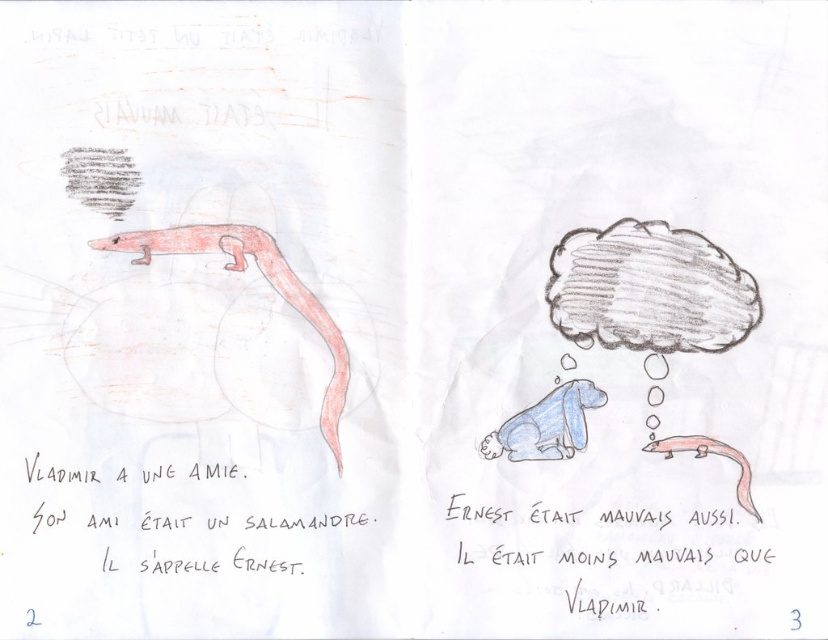
Question: Is pink matte salamander at center in front of blue paper dog at center?

Choices:
 (A) yes
 (B) no

Answer: (A)

Question: Does pink matte salamander at center have a greater width compared to blue paper dog at center?

Choices:
 (A) no
 (B) yes

Answer: (B)

Question: Which object is closer to the camera taking this photo?

Choices:
 (A) pink matte salamander at center
 (B) blue paper dog at center
 (C) gray textured cloud at upper center
 (D) matte pink salamander at lower right

Answer: (D)

Question: Which point is closer to the camera?

Choices:
 (A) blue paper dog at center
 (B) pink matte salamander at center

Answer: (B)

Question: Which of the following is the farthest from the observer?

Choices:
 (A) (567, 440)
 (B) (595, 308)
 (C) (328, 320)
 (D) (724, 456)

Answer: (B)

Question: Does gray textured cloud at upper center appear on the right side of blue paper dog at center?

Choices:
 (A) yes
 (B) no

Answer: (A)